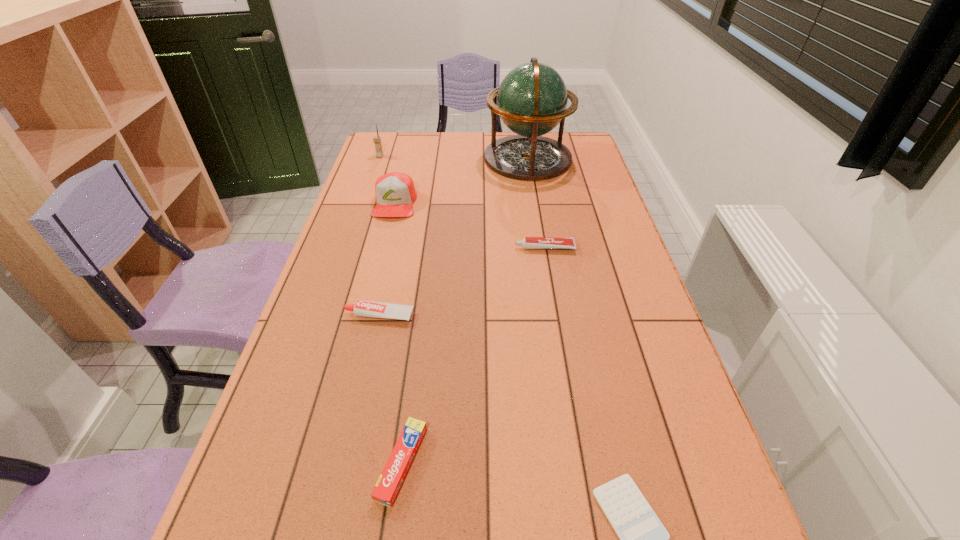
Locate an element on the screen. The width and height of the screenshot is (960, 540). free location located on the front-facing side of the tallest object is located at coordinates (419, 159).

Where is `free space located 0.250m on the front-facing side of the tallest object`? The height and width of the screenshot is (540, 960). free space located 0.250m on the front-facing side of the tallest object is located at coordinates (419, 159).

Where is `blank space located on the front-facing side of the tallest object`? blank space located on the front-facing side of the tallest object is located at coordinates (437, 159).

Identify the location of free space located 0.120m on the front of the sixth shortest object, where the keypad is located. (373, 174).

I want to click on vacant space located on the front-facing side of the third tallest object, so (x=379, y=265).

You are a GUI agent. You are given a task and a screenshot of the screen. Output one action in this format:
    pyautogui.click(x=<x>, y=<y>)
    Task: Click on the free space located on the left of the second farthest toothpaste
    The height and width of the screenshot is (540, 960).
    Given the screenshot: What is the action you would take?
    pyautogui.click(x=313, y=316)

Locate an element on the screen. This screenshot has height=540, width=960. free space located at the nozzle of the farthest toothpaste is located at coordinates point(498,248).

I want to click on vacant area situated at the nozzle of the farthest toothpaste, so click(x=430, y=248).

The height and width of the screenshot is (540, 960). Find the location of `vacant space situated 0.050m at the nozzle of the farthest toothpaste`. vacant space situated 0.050m at the nozzle of the farthest toothpaste is located at coordinates (x=498, y=248).

This screenshot has width=960, height=540. What are the coordinates of `vacant area situated on the right of the second shortest object` in the screenshot? It's located at (477, 463).